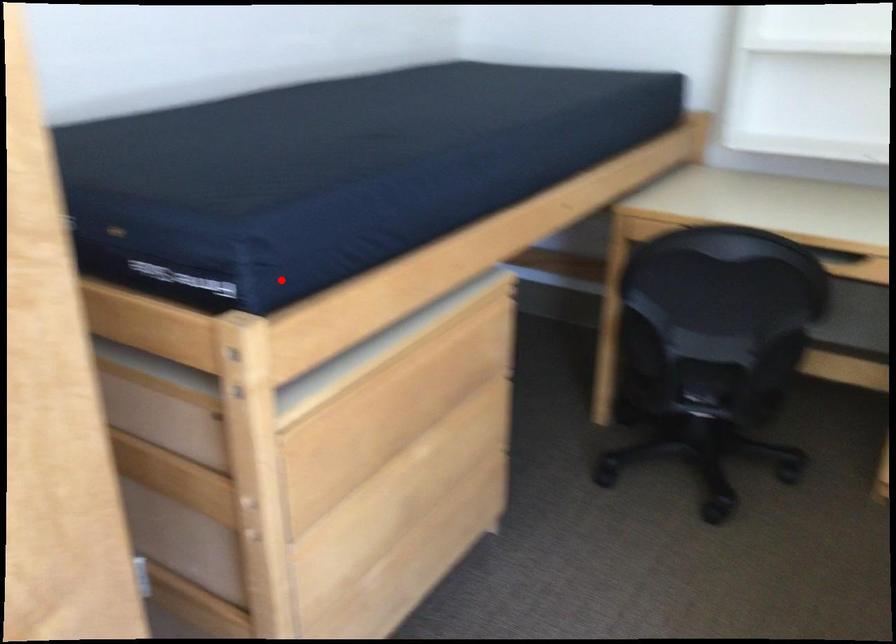
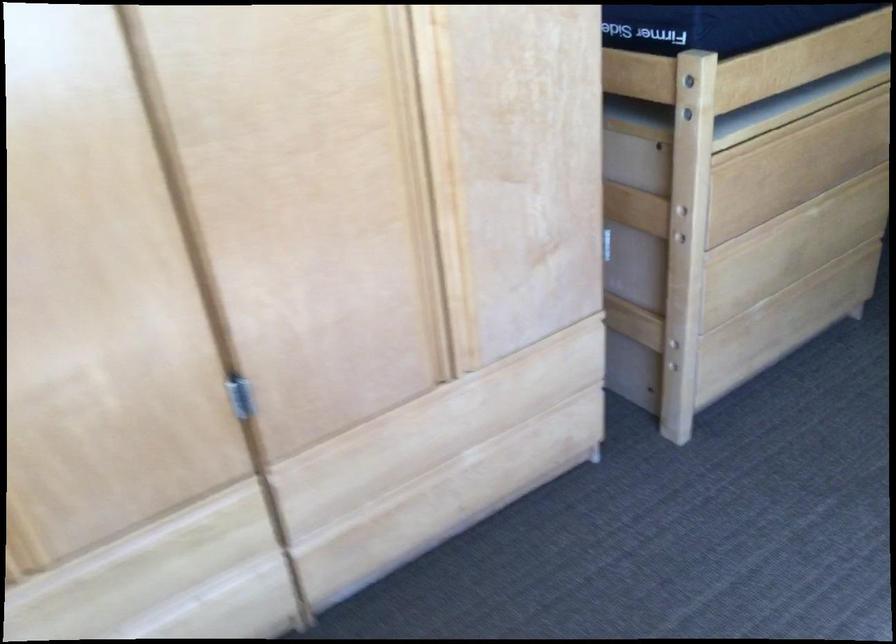
Question: I am providing you with two images of the same scene from different viewpoints. Given a red point in image1, look at the same physical point in image2. Is it:

Choices:
 (A) Closer to the viewpoint
 (B) Farther from the viewpoint

Answer: (B)